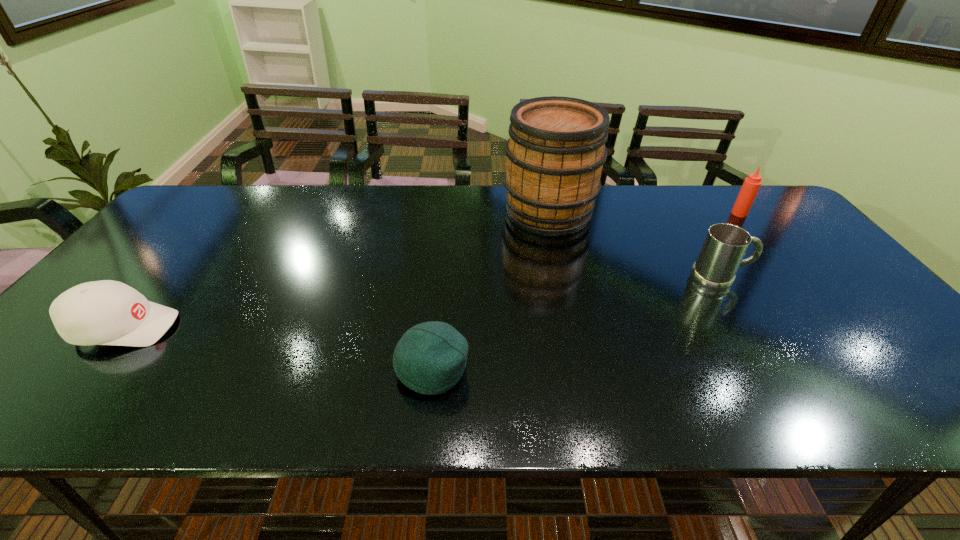
You are a GUI agent. You are given a task and a screenshot of the screen. Output one action in this format:
    pyautogui.click(x=<x>, y=<y>)
    Task: Click on the free region located on the back of the beanie
    The width and height of the screenshot is (960, 540).
    Given the screenshot: What is the action you would take?
    pyautogui.click(x=443, y=271)

Where is `vacant space located on the front-facing side of the baseball cap`? vacant space located on the front-facing side of the baseball cap is located at coordinates (332, 328).

Find the location of a particular element. The height and width of the screenshot is (540, 960). cider that is positioned at the far edge is located at coordinates (555, 154).

Identify the location of Tabasco sauce at the far edge. (751, 185).

At what (x,y) coordinates should I click in order to perform the action: click on object that is at the near edge. Please return your answer as a coordinate pair (x, y). Looking at the image, I should click on (430, 358).

This screenshot has height=540, width=960. Find the location of `object that is positioned at the left edge`. object that is positioned at the left edge is located at coordinates (106, 312).

Image resolution: width=960 pixels, height=540 pixels. Find the location of `object that is at the right edge`. object that is at the right edge is located at coordinates (751, 185).

This screenshot has height=540, width=960. What are the coordinates of `object located at the far right corner` in the screenshot? It's located at (751, 185).

This screenshot has height=540, width=960. Find the location of `free space at the far edge`. free space at the far edge is located at coordinates (350, 187).

The height and width of the screenshot is (540, 960). In the image, there is a desktop. In order to click on vacant space at the near edge in this screenshot , I will do `click(101, 393)`.